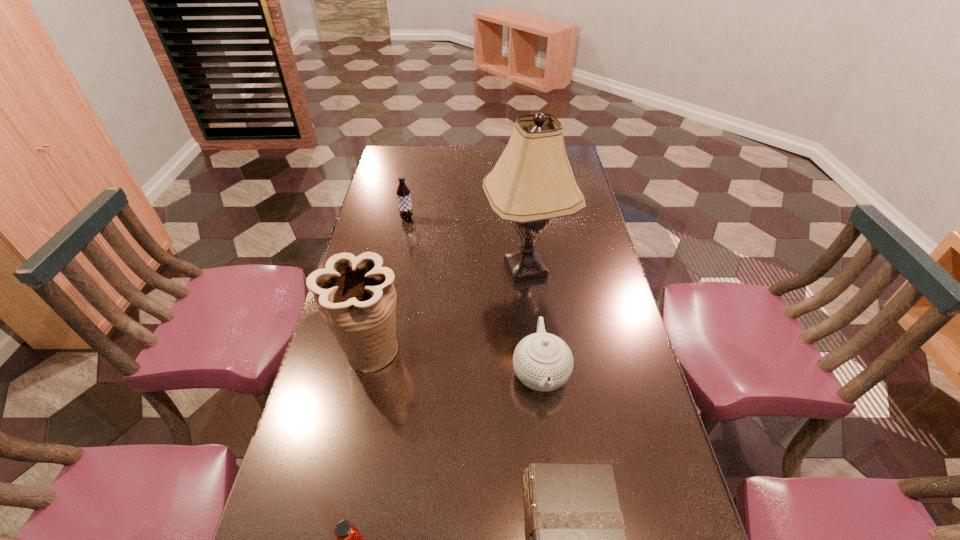
The width and height of the screenshot is (960, 540). I want to click on urn present at the left edge, so tap(356, 297).

Where is `root beer positioned at the left edge`? root beer positioned at the left edge is located at coordinates (403, 193).

Where is `object that is at the right edge`? This screenshot has width=960, height=540. object that is at the right edge is located at coordinates (532, 182).

In the image, there is a desktop. Where is `free space at the far edge`? free space at the far edge is located at coordinates (444, 168).

This screenshot has width=960, height=540. What are the coordinates of `vacant space at the left edge` in the screenshot? It's located at pyautogui.click(x=392, y=193).

I want to click on free space at the right edge, so click(608, 308).

In the image, there is a desktop. Where is `vacant area at the far left corner`? Image resolution: width=960 pixels, height=540 pixels. vacant area at the far left corner is located at coordinates (395, 149).

Identify the location of blank region between the fifth shortest object and the fifth nearest object. This screenshot has width=960, height=540. (447, 309).

Image resolution: width=960 pixels, height=540 pixels. What are the coordinates of `free space between the lamp and the urn` in the screenshot? It's located at (447, 309).

Locate an element on the screen. free space between the tallest object and the fifth shortest object is located at coordinates (447, 309).